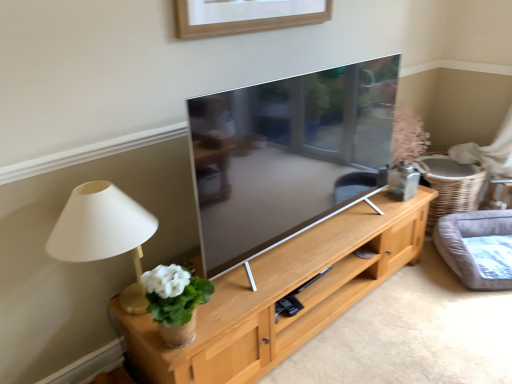
Question: Considering their positions, is light wood cabinet at center located in front of or behind gray fabric cat bed at right?

Choices:
 (A) behind
 (B) front

Answer: (B)

Question: Considering the positions of light wood cabinet at center and gray fabric cat bed at right in the image, is light wood cabinet at center bigger or smaller than gray fabric cat bed at right?

Choices:
 (A) big
 (B) small

Answer: (A)

Question: Based on their relative distances, which object is nearer to the matte beige lamp at left?

Choices:
 (A) light wood cabinet at center
 (B) gray fabric cat bed at right
 (C) white ceramic vase at left

Answer: (C)

Question: Estimate the real-world distances between objects in this image. Which object is closer to the gray fabric cat bed at right?

Choices:
 (A) white ceramic vase at left
 (B) matte beige lamp at left
 (C) light wood cabinet at center

Answer: (C)